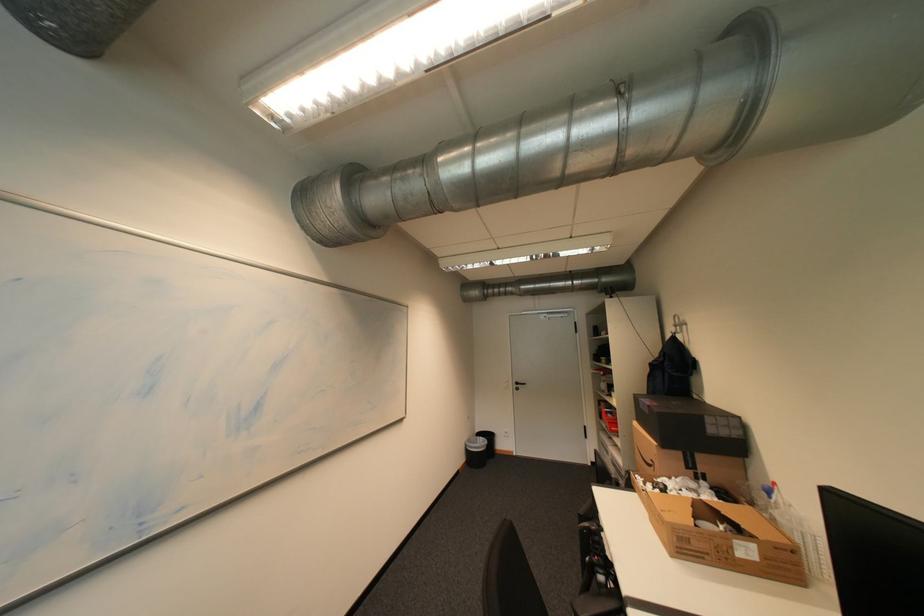
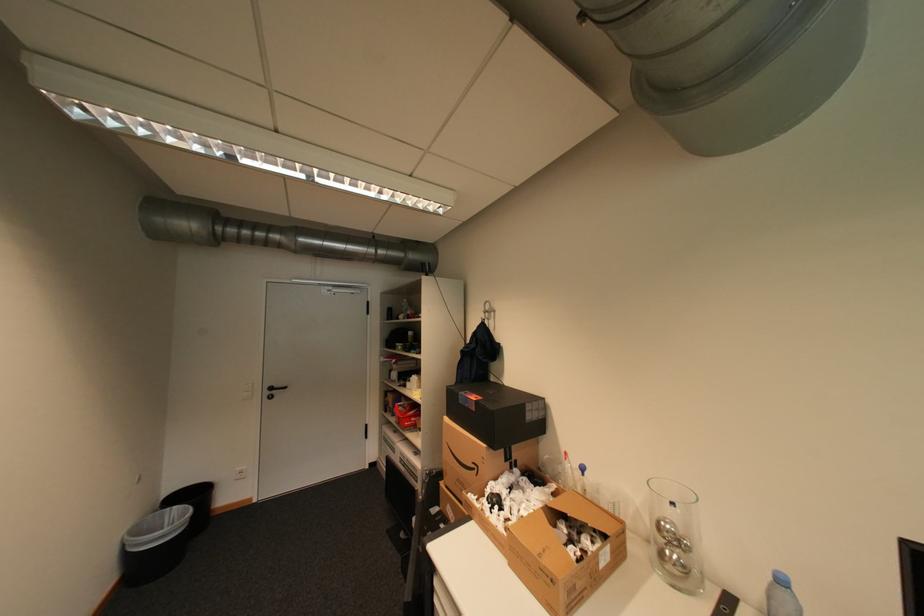
Where in the second image is the point corresponding to (x=662, y=464) from the first image?

(484, 468)